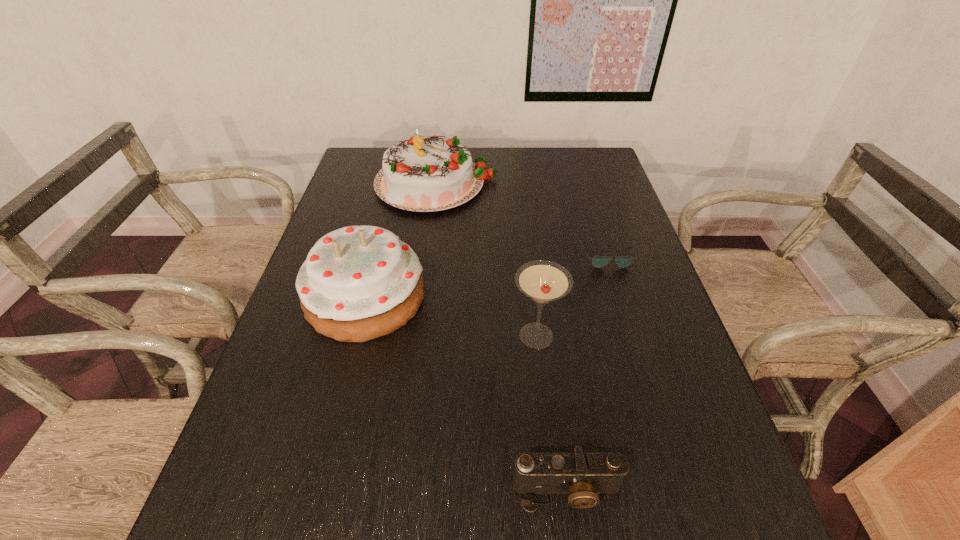
At what (x,y) coordinates should I click in order to perform the action: click on vacant space located 0.300m on the lenses of the sunglasses. Please return your answer as a coordinate pair (x, y). This screenshot has width=960, height=540. Looking at the image, I should click on (641, 364).

I want to click on object located at the far edge, so click(423, 174).

Where is `object at the right edge`? object at the right edge is located at coordinates (598, 261).

I want to click on object at the far left corner, so click(423, 174).

At what (x,y) coordinates should I click in order to perform the action: click on free space at the far edge. Please return your answer as a coordinate pair (x, y). The height and width of the screenshot is (540, 960). Looking at the image, I should click on (481, 149).

In the image, there is a desktop. Find the location of `vacant space at the left edge`. vacant space at the left edge is located at coordinates (254, 416).

This screenshot has width=960, height=540. I want to click on free space at the right edge, so click(633, 389).

In the image, there is a desktop. At what (x,y) coordinates should I click in order to perform the action: click on blank space at the far left corner. Please return your answer as a coordinate pair (x, y). Image resolution: width=960 pixels, height=540 pixels. Looking at the image, I should click on (347, 178).

This screenshot has height=540, width=960. Find the location of `blank space at the far right corner`. blank space at the far right corner is located at coordinates (602, 173).

This screenshot has height=540, width=960. I want to click on free space between the nearest object and the martini, so click(552, 414).